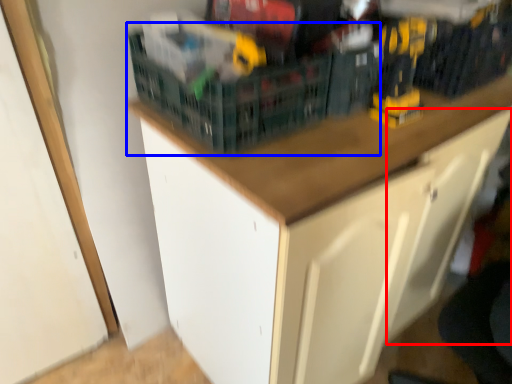
Question: Which of the following is the closest to the observer, drawer (highlighted by a red box) or basket (highlighted by a blue box)?

Choices:
 (A) drawer
 (B) basket

Answer: (A)